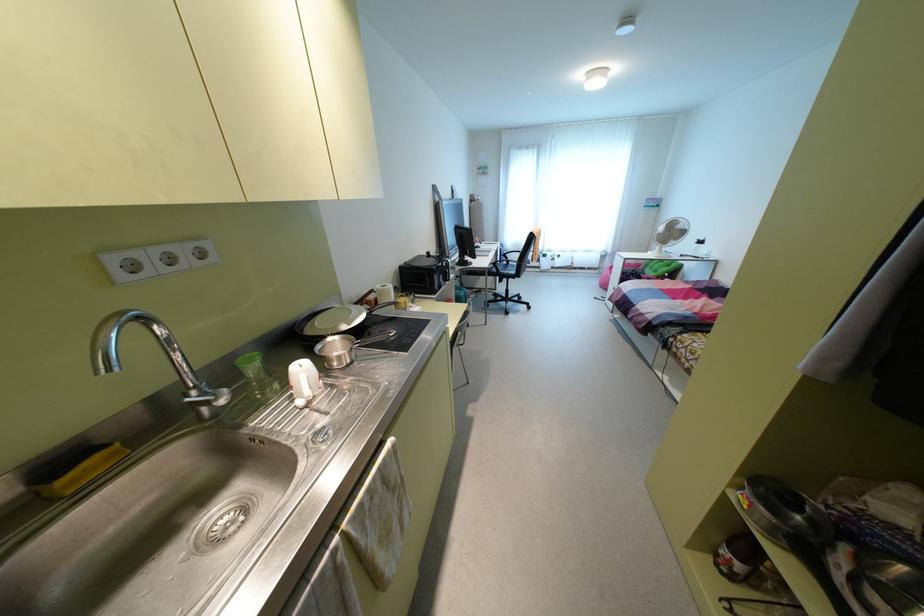
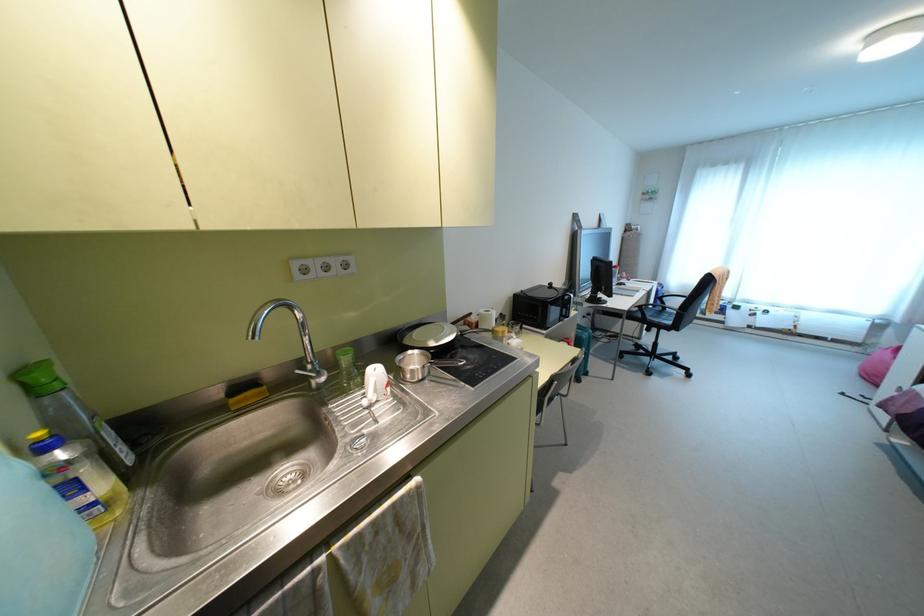
Where in the second image is the point corresponding to (195,387) from the first image?

(310, 362)